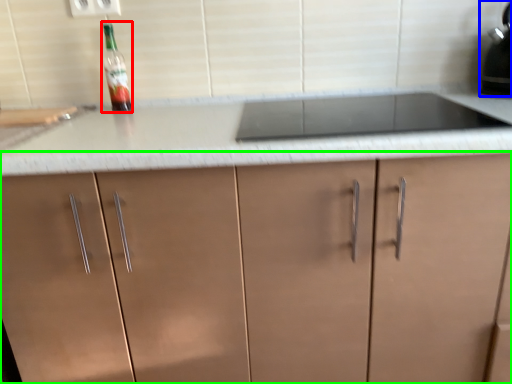
Question: Which is nearer to the bottle (highlighted by a red box)? kitchen appliance (highlighted by a blue box) or cabinetry (highlighted by a green box).

Choices:
 (A) kitchen appliance
 (B) cabinetry

Answer: (B)